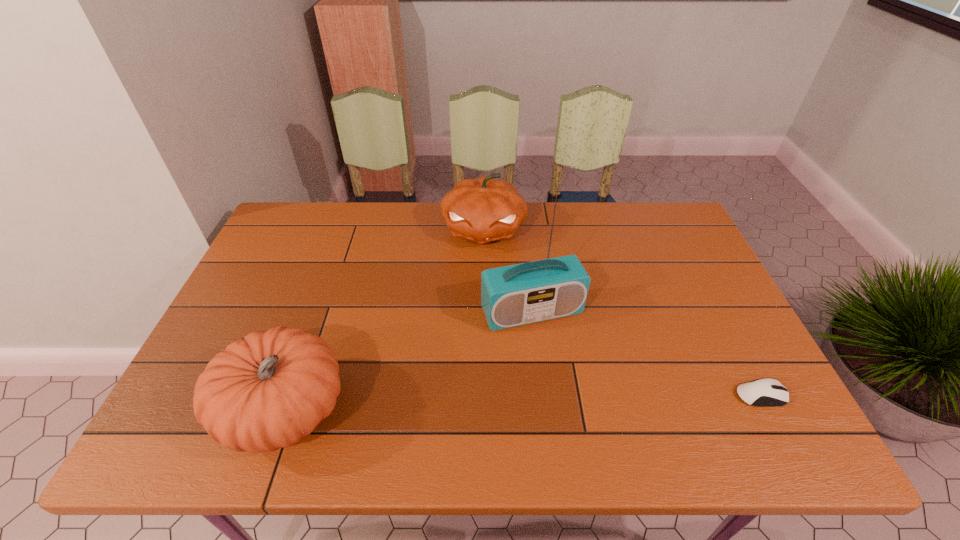
Where is `blank space that satisfies the following two spatial constraints: 1. on the back side of the tallest object; 2. on the right side of the nearer pumpkin`? The image size is (960, 540). blank space that satisfies the following two spatial constraints: 1. on the back side of the tallest object; 2. on the right side of the nearer pumpkin is located at coordinates (321, 312).